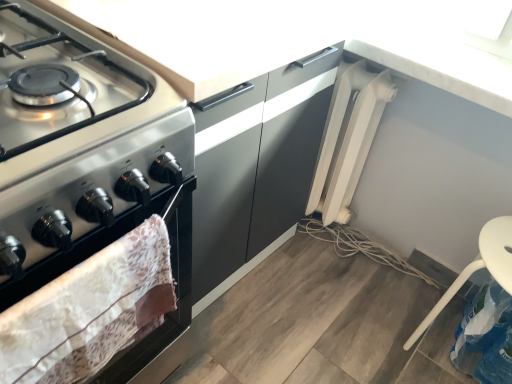
Question: Are white plastic chair at lower right and white plastic radiator at lower right located far from each other?

Choices:
 (A) yes
 (B) no

Answer: (B)

Question: Considering the relative positions of white plastic chair at lower right and white plastic radiator at lower right in the image provided, is white plastic chair at lower right to the right of white plastic radiator at lower right from the viewer's perspective?

Choices:
 (A) yes
 (B) no

Answer: (A)

Question: From a real-world perspective, is white plastic chair at lower right located beneath white plastic radiator at lower right?

Choices:
 (A) no
 (B) yes

Answer: (A)

Question: Is white plastic radiator at lower right at the back of white plastic chair at lower right?

Choices:
 (A) no
 (B) yes

Answer: (A)

Question: Is white plastic chair at lower right behind white plastic radiator at lower right?

Choices:
 (A) yes
 (B) no

Answer: (B)

Question: From a real-world perspective, relative to white plastic radiator at lower right, is white plastic radiator at upper right vertically above or below?

Choices:
 (A) above
 (B) below

Answer: (A)

Question: Based on their sizes in the image, would you say white plastic radiator at upper right is bigger or smaller than white plastic radiator at lower right?

Choices:
 (A) small
 (B) big

Answer: (B)

Question: Is white plastic radiator at upper right wider or thinner than white plastic radiator at lower right?

Choices:
 (A) wide
 (B) thin

Answer: (B)

Question: In the image, is white plastic radiator at upper right positioned in front of or behind white plastic radiator at lower right?

Choices:
 (A) behind
 (B) front

Answer: (B)

Question: Is white plastic radiator at lower right situated inside white plastic chair at lower right or outside?

Choices:
 (A) inside
 (B) outside

Answer: (B)

Question: Would you say white plastic radiator at lower right is to the left or to the right of white plastic chair at lower right in the picture?

Choices:
 (A) right
 (B) left

Answer: (B)

Question: From the image's perspective, is white plastic radiator at lower right above or below white plastic chair at lower right?

Choices:
 (A) below
 (B) above

Answer: (B)

Question: Considering the positions of point (380, 256) and point (508, 251), is point (380, 256) closer or farther from the camera than point (508, 251)?

Choices:
 (A) closer
 (B) farther

Answer: (B)

Question: Is white plastic radiator at upper right bigger or smaller than white plastic chair at lower right?

Choices:
 (A) small
 (B) big

Answer: (A)

Question: Relative to white plastic chair at lower right, is white plastic radiator at upper right in front or behind?

Choices:
 (A) front
 (B) behind

Answer: (B)